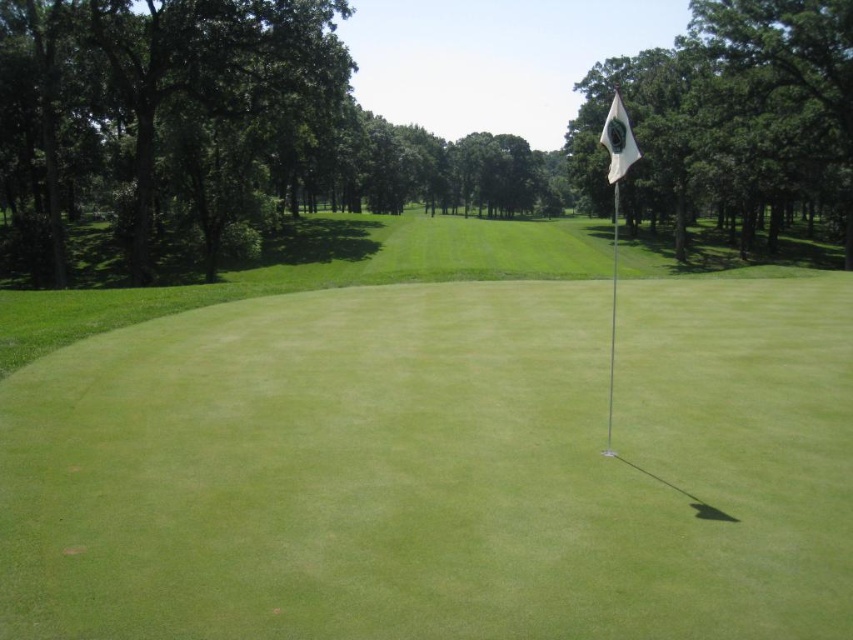
You are a golfer standing on the tee, aiming to hit your ball to the green. You notice the green grass flag at center and the white fabric flag at upper right. Which flag is closer to your current position?

The green grass flag at center is closer to your current position because it is only 10.83 meters away from the white fabric flag at upper right, but the question does not provide the distance from your position to either flag.

You are standing at the center of the putting green and want to hit a golf ball to the flagpole in the center right. There is a green leafy tree at upper right. Will the tree block your shot? Please explain your reasoning based on the coordinates provided.

The green leafy tree at upper right is located at coordinates point (735, 109), which is in the upper right corner of the image. Since you are standing at the center of the putting green aiming for the flagpole in the center right, the tree is positioned above and to the right of your target. This means the tree is not directly in the line of your shot, so it should not block your path.

You are a golfer standing at the tee box preparing to hit a ball towards the green grass flag at center. Based on the coordinates provided, in which direction should you aim your shot relative to the flagpole to ensure the ball rolls towards the flag?

The green grass flag at center is located at coordinates 0.702 on the x axis and 0.508 on the y axis. To aim your shot towards the flagpole, you should align your shot directly at the coordinates provided, as the flag is already at the center of the green. However, considering the flag is slightly to the right of the exact center point, you might want to aim slightly to the right of the flagpole to account for the slope or curvature of the green.